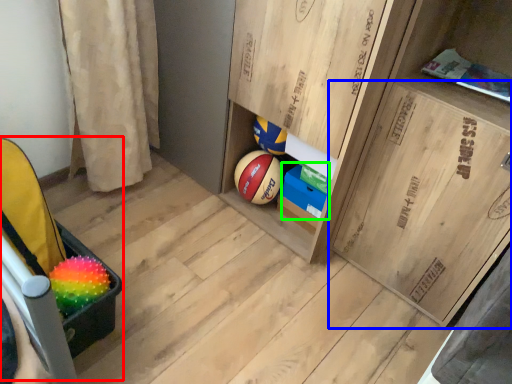
Question: Which is nearer to the baby carriage (highlighted by a red box)? cabinetry (highlighted by a blue box) or cabinetry (highlighted by a green box).

Choices:
 (A) cabinetry
 (B) cabinetry

Answer: (B)